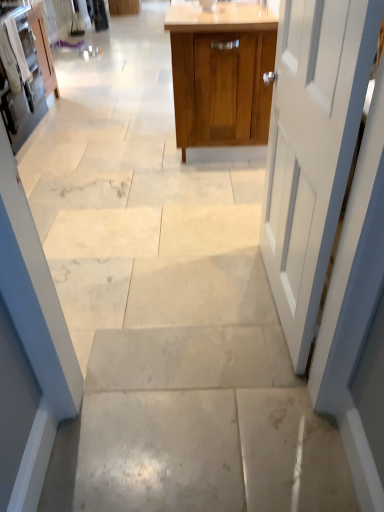
Where is `vacant area that lies between white painted wood door at right and matte white cabinet at upper left, the 1th cabinetry from the left`? The image size is (384, 512). vacant area that lies between white painted wood door at right and matte white cabinet at upper left, the 1th cabinetry from the left is located at coordinates (143, 156).